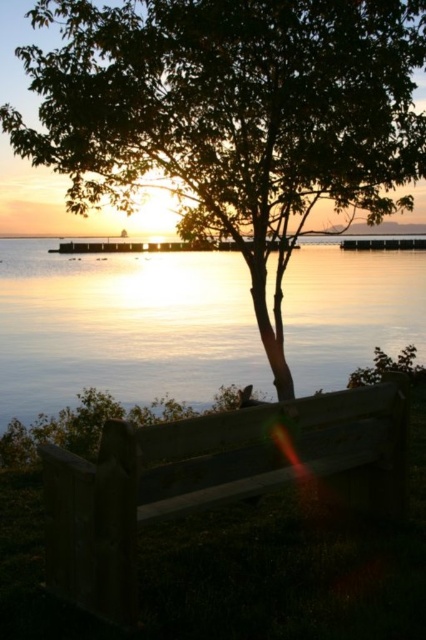
You are sitting on the wooden bench at center and looking towards the glistening silver water at center. Which object is closer to you?

The wooden bench at center is closer to you since you are sitting on it, while the glistening silver water at center is further away.

Based on the photo, you are a painter standing at the edge of the water. You want to paint the sunset scene. Which object, the glistening silver water at center or the wooden bench at center, will you need to look up at more to paint?

The glistening silver water at center has a greater height compared to the wooden bench at center, so you will need to look up more to paint the glistening silver water at center.

You are sitting on the wooden bench in the foreground and want to look at both the green leafy tree at center and the glistening silver water at center. Which object will you turn to your right to see?

The glistening silver water at center is to the right of the green leafy tree at center, so you would turn to your right to see the glistening silver water at center.